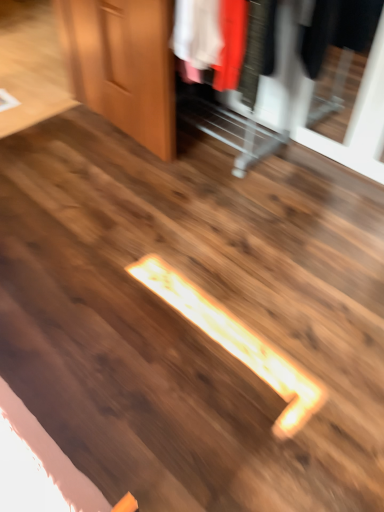
What are the coordinates of `free space in front of wooden door at upper left` in the screenshot? It's located at (108, 178).